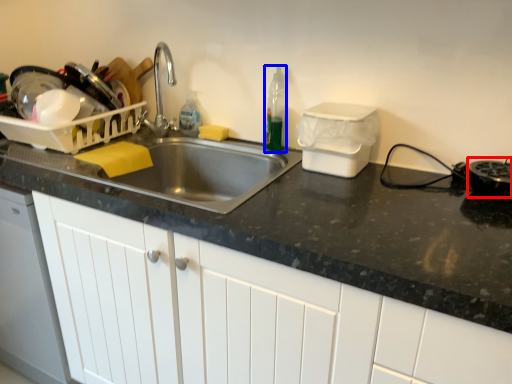
Question: Which point is closer to the camera, appliance (highlighted by a red box) or bottle (highlighted by a blue box)?

Choices:
 (A) appliance
 (B) bottle

Answer: (A)